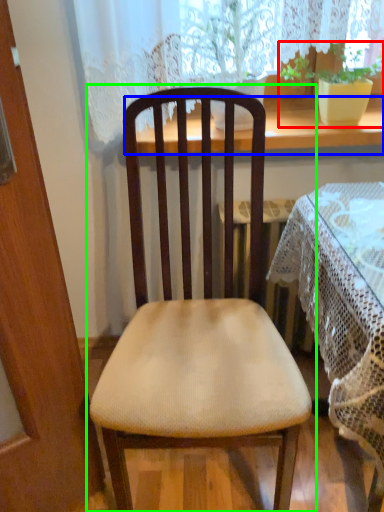
Question: Considering the real-world distances, which object is closest to houseplant (highlighted by a red box)? window sill (highlighted by a blue box) or chair (highlighted by a green box).

Choices:
 (A) window sill
 (B) chair

Answer: (A)